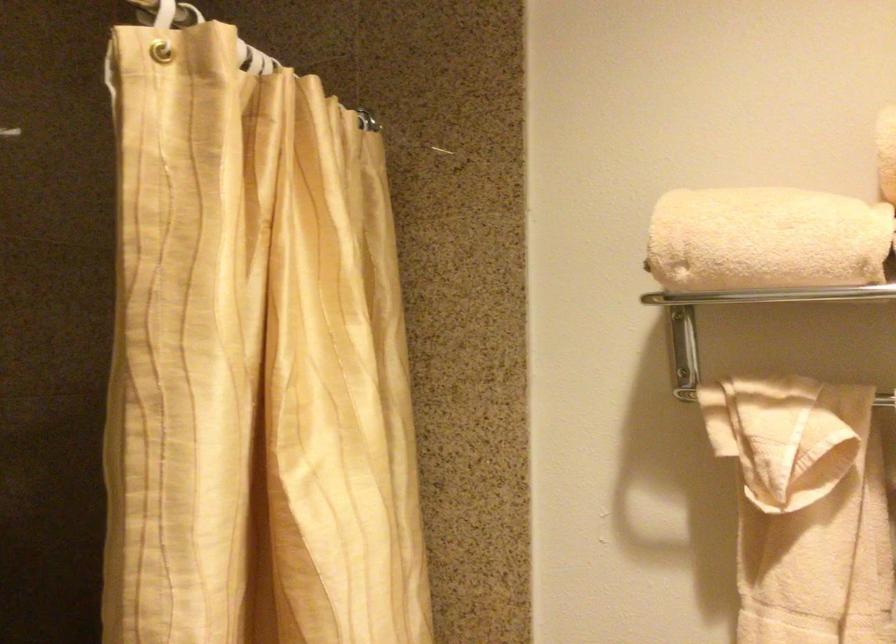
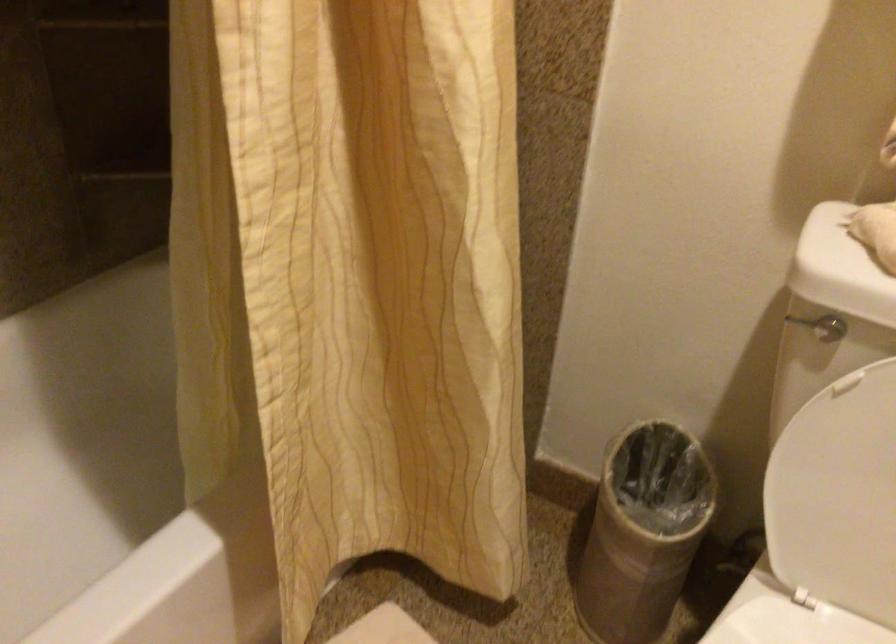
Question: The images are taken continuously from a first-person perspective. In which direction is your viewpoint rotating?

Choices:
 (A) Left
 (B) Right
 (C) Up
 (D) Down

Answer: (D)